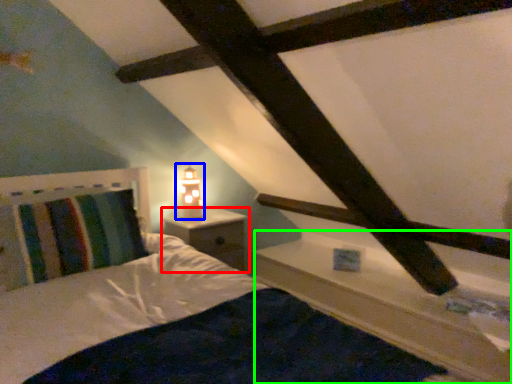
Question: Estimate the real-world distances between objects in this image. Which object is farther from nightstand (highlighted by a red box), table lamp (highlighted by a blue box) or ledge (highlighted by a green box)?

Choices:
 (A) table lamp
 (B) ledge

Answer: (B)